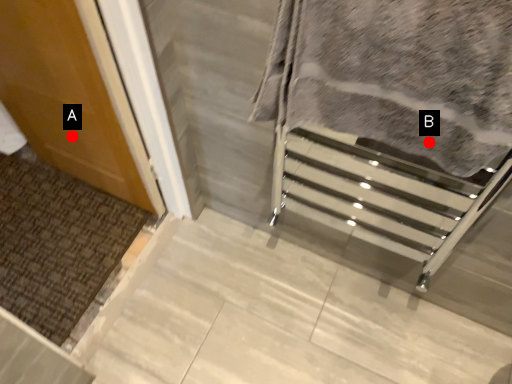
Question: Two points are circled on the image, labeled by A and B beside each circle. Among these points, which one is farthest from the camera?

Choices:
 (A) A is further
 (B) B is further

Answer: (A)